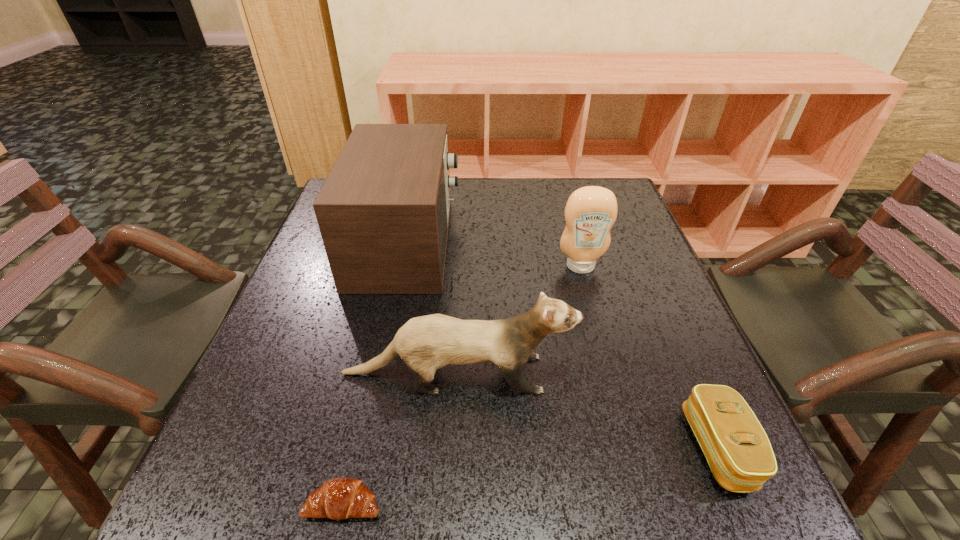
I want to click on vacant space located on the zipper side of the clutch bag, so click(x=647, y=448).

Identify the location of vacant space located 0.320m on the zipper side of the clutch bag. The width and height of the screenshot is (960, 540). (491, 448).

Find the location of a particular element. The width and height of the screenshot is (960, 540). free region located 0.250m on the back of the crescent roll is located at coordinates (377, 353).

Image resolution: width=960 pixels, height=540 pixels. I want to click on object present at the far edge, so click(383, 212).

Identify the location of clutch bag that is at the near edge. (738, 451).

The image size is (960, 540). I want to click on crescent roll that is positioned at the near edge, so click(340, 498).

What are the coordinates of `object at the left edge` in the screenshot? It's located at [x=383, y=212].

The width and height of the screenshot is (960, 540). In order to click on condiment that is positioned at the right edge in this screenshot , I will do `click(590, 212)`.

I want to click on clutch bag at the right edge, so click(738, 451).

Identify the location of object present at the far left corner. The width and height of the screenshot is (960, 540). (383, 212).